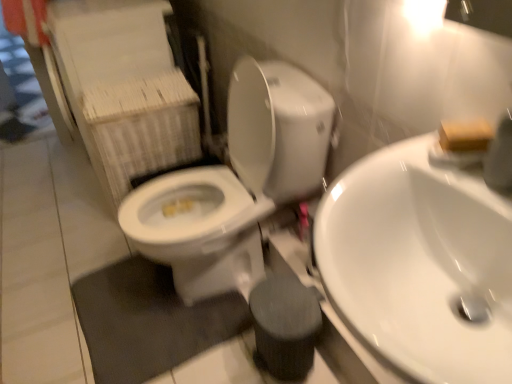
In order to face white glossy sink at center right, should I rotate leftwards or rightwards?

Turn right by 22.912 degrees to look at white glossy sink at center right.

At what (x,y) coordinates should I click in order to perform the action: click on white glossy toilet at center. Please return your answer as a coordinate pair (x, y). Looking at the image, I should click on (237, 182).

You are a GUI agent. You are given a task and a screenshot of the screen. Output one action in this format:
    pyautogui.click(x=<x>, y=<y>)
    Task: Click on the soap that is in front of the white glossy toilet at center
    
    Given the screenshot: What is the action you would take?
    pyautogui.click(x=465, y=135)

From a real-world perspective, which object rests below the other?

white glossy toilet at center.

Which is behind, white glossy toilet at center or wooden block at upper right?

white glossy toilet at center is more distant.

Can you confirm if white glossy toilet at center is bigger than wooden block at upper right?

Correct, white glossy toilet at center is larger in size than wooden block at upper right.

From a real-world perspective, relative to white glossy sink at center right, is wooden block at upper right vertically above or below?

wooden block at upper right is above white glossy sink at center right.

From the image's perspective, between wooden block at upper right and white glossy sink at center right, who is located below?

From the image's view, white glossy sink at center right is below.

Is point (484, 120) closer to camera compared to point (385, 215)?

No, it is behind (385, 215).

Is wooden block at upper right positioned with its back to white glossy sink at center right?

wooden block at upper right does not have its back to white glossy sink at center right.

Is white glossy sink at center right directly adjacent to white glossy toilet at center?

No, white glossy sink at center right is not beside white glossy toilet at center.

From the image's perspective, is white glossy sink at center right under white glossy toilet at center?

Yes, from the image's perspective, white glossy sink at center right is beneath white glossy toilet at center.

Can you confirm if white glossy sink at center right is bigger than wooden block at upper right?

Yes, white glossy sink at center right is bigger than wooden block at upper right.

Based on their positions, is white glossy sink at center right located to the left or right of wooden block at upper right?

Based on their positions, white glossy sink at center right is located to the left of wooden block at upper right.

How different are the orientations of white glossy sink at center right and wooden block at upper right in degrees?

The angle between the facing direction of white glossy sink at center right and the facing direction of wooden block at upper right is 61.8 degrees.

Can you confirm if white glossy sink at center right is taller than wooden block at upper right?

Yes.

Does wooden block at upper right have a lesser width compared to white glossy toilet at center?

Yes.

Is wooden block at upper right facing towards white glossy toilet at center?

No, wooden block at upper right does not turn towards white glossy toilet at center.

From a real-world perspective, who is located higher, wooden block at upper right or white glossy toilet at center?

wooden block at upper right, from a real-world perspective.

From the image's perspective, is white glossy toilet at center on top of white glossy sink at center right?

Yes, from the image's perspective, white glossy toilet at center is above white glossy sink at center right.

What's the angular difference between white glossy toilet at center and white glossy sink at center right's facing directions?

1.46 degrees.

Who is smaller, white glossy toilet at center or white glossy sink at center right?

With smaller size is white glossy sink at center right.

In the image, is white glossy toilet at center positioned in front of or behind white glossy sink at center right?

In the image, white glossy toilet at center appears behind white glossy sink at center right.

Find the location of a particular element. Image resolution: width=512 pixels, height=384 pixels. soap on the right side of white glossy toilet at center is located at coordinates (465, 135).

Image resolution: width=512 pixels, height=384 pixels. In order to click on soap above the white glossy sink at center right (from a real-world perspective) in this screenshot , I will do `click(465, 135)`.

Which object lies further to the anchor point white glossy toilet at center, white glossy sink at center right or wooden block at upper right?

wooden block at upper right is further to white glossy toilet at center.

When comparing their distances from white glossy sink at center right, does wooden block at upper right or white glossy toilet at center seem further?

white glossy toilet at center.

Estimate the real-world distances between objects in this image. Which object is closer to white glossy toilet at center, wooden block at upper right or white glossy sink at center right?

Among the two, white glossy sink at center right is located nearer to white glossy toilet at center.

Looking at the image, which one is located closer to wooden block at upper right, white glossy sink at center right or white glossy toilet at center?

Based on the image, white glossy sink at center right appears to be nearer to wooden block at upper right.

From the picture: Estimate the real-world distances between objects in this image. Which object is further from white glossy sink at center right, white glossy toilet at center or wooden block at upper right?

white glossy toilet at center.

Which object lies further to the anchor point wooden block at upper right, white glossy toilet at center or white glossy sink at center right?

white glossy toilet at center lies further to wooden block at upper right than the other object.

Locate an element on the screen. The height and width of the screenshot is (384, 512). sink between white glossy toilet at center and wooden block at upper right from left to right is located at coordinates (419, 263).